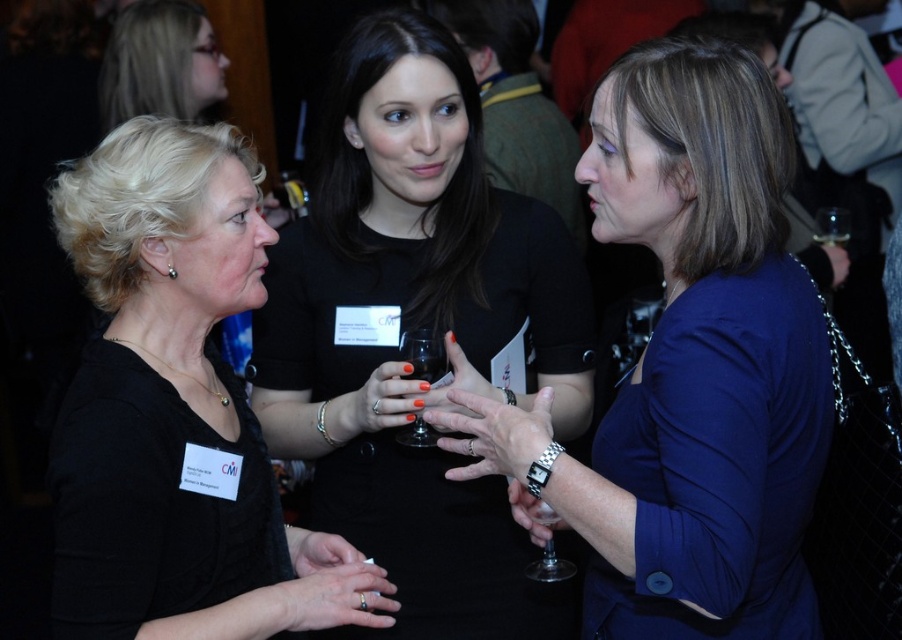
Question: Which point is farther to the camera?

Choices:
 (A) (250, 260)
 (B) (413, 371)

Answer: (B)

Question: Can you confirm if black matte shirt at left is thinner than clear glass at upper right?

Choices:
 (A) yes
 (B) no

Answer: (B)

Question: Which of the following is the farthest from the observer?

Choices:
 (A) (437, 358)
 (B) (189, 58)
 (C) (668, 422)

Answer: (B)

Question: Is black matte shirt at left to the right of clear glass at upper right from the viewer's perspective?

Choices:
 (A) no
 (B) yes

Answer: (A)

Question: Based on their relative distances, which object is farther from the transparent glass wine glass at center?

Choices:
 (A) black matte shirt at left
 (B) transparent glass at right
 (C) clear glass at upper right

Answer: (C)

Question: Considering the relative positions of blue fabric jacket at center and black matte shirt at left in the image provided, where is blue fabric jacket at center located with respect to black matte shirt at left?

Choices:
 (A) above
 (B) below

Answer: (A)